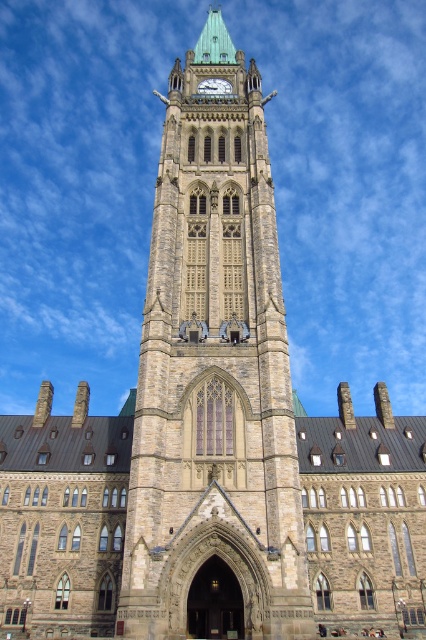
Question: Among these objects, which one is nearest to the camera?

Choices:
 (A) gold metallic clock at center
 (B) brown stone clock tower at center

Answer: (B)

Question: Does brown stone clock tower at center appear over gold metallic clock at center?

Choices:
 (A) yes
 (B) no

Answer: (A)

Question: Is brown stone clock tower at center positioned before gold metallic clock at center?

Choices:
 (A) yes
 (B) no

Answer: (A)

Question: Is brown stone clock tower at center below gold metallic clock at center?

Choices:
 (A) no
 (B) yes

Answer: (A)

Question: Which of the following is the farthest from the observer?

Choices:
 (A) brown stone clock tower at center
 (B) gold metallic clock at center

Answer: (B)